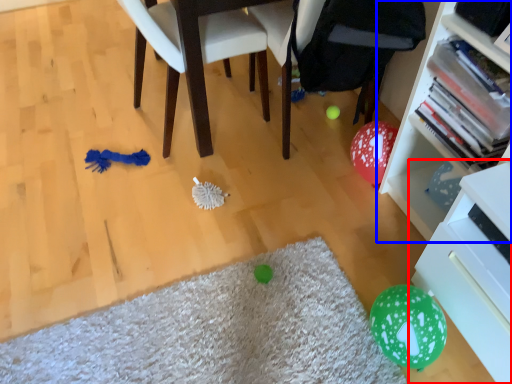
Question: Which point is closer to the camera, shelf (highlighted by a red box) or bookcase (highlighted by a blue box)?

Choices:
 (A) shelf
 (B) bookcase

Answer: (A)